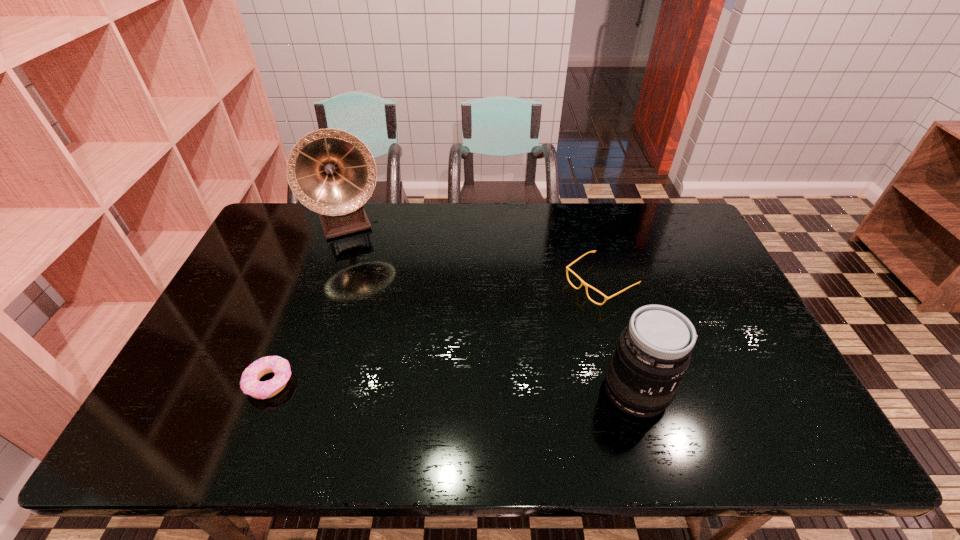
The width and height of the screenshot is (960, 540). Find the location of `the shortest object`. the shortest object is located at coordinates (249, 383).

The width and height of the screenshot is (960, 540). I want to click on telephoto lens, so click(653, 352).

I want to click on the third nearest object, so click(x=586, y=285).

Identify the location of the third tallest object. (586, 285).

Identify the location of the farthest object. (330, 171).

Where is `the tallest object`? This screenshot has width=960, height=540. the tallest object is located at coordinates (330, 171).

I want to click on free spot located 0.100m on the right of the shortest object, so click(334, 382).

Find the location of a particular element. Image resolution: width=960 pixels, height=540 pixels. vacant space located 0.170m on the right of the telephoto lens is located at coordinates (739, 390).

The width and height of the screenshot is (960, 540). Identify the location of vacant region located 0.390m in front of the lenses of the spectacles. (469, 367).

At what (x,y) coordinates should I click in order to perform the action: click on free space located in front of the lenses of the spectacles. Please return your answer as a coordinate pair (x, y). This screenshot has width=960, height=540. Looking at the image, I should click on (533, 326).